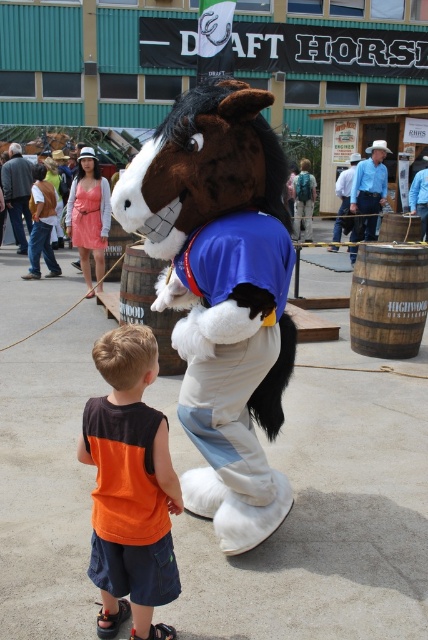
From the picture: You are standing at the center of the fairground and see the point marked at coordinate (219, 294). What object is located at that point?

The point at coordinate (219, 294) corresponds to the brown plush horse at center.

You are a photographer at the fair trying to capture a photo of the brown plush horse at center without the orange fabric shirt at lower left appearing in the frame. Can you adjust your angle to achieve this?

The brown plush horse at center is positioned over orange fabric shirt at lower left, so moving the camera angle slightly upward or to the side might allow you to frame the horse without the shirt being visible.